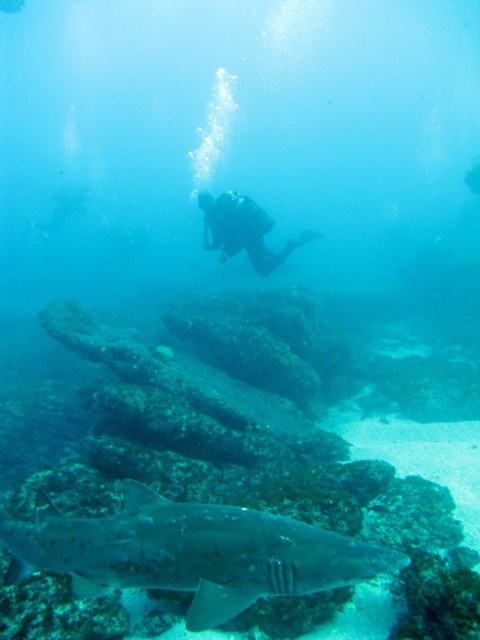
Is gray textured shark at lower center below black rubber scuba diver at center?

Yes.

Is point (148, 557) positioned after point (251, 221)?

No, (148, 557) is in front of (251, 221).

The width and height of the screenshot is (480, 640). I want to click on gray textured shark at lower center, so click(192, 554).